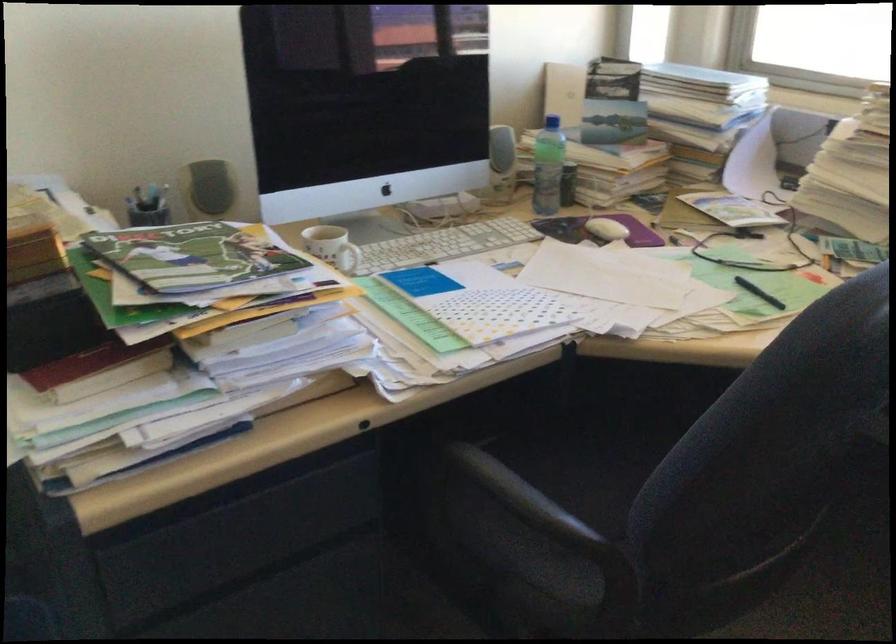
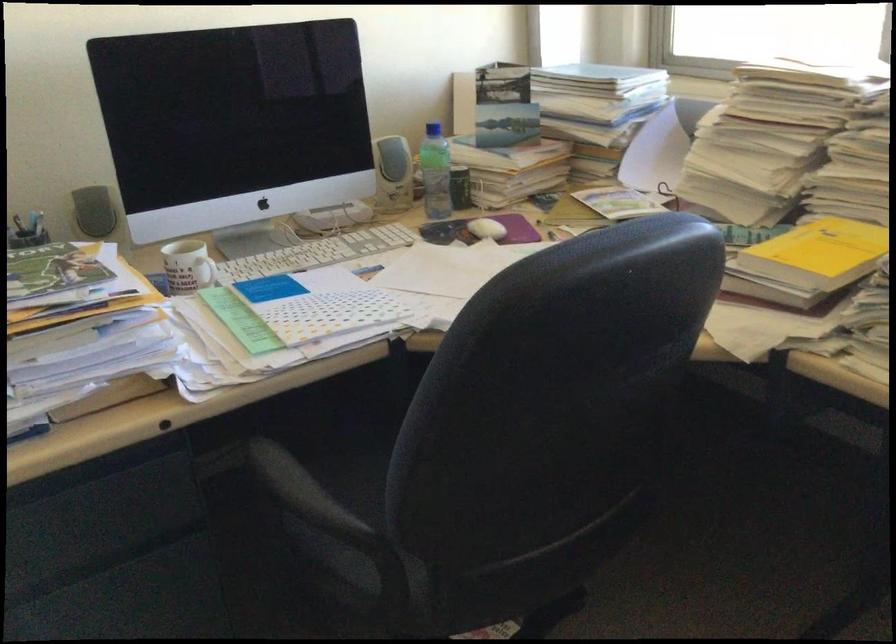
In the second image, find the point that corresponds to the point at 610,229 in the first image.

(487, 229)